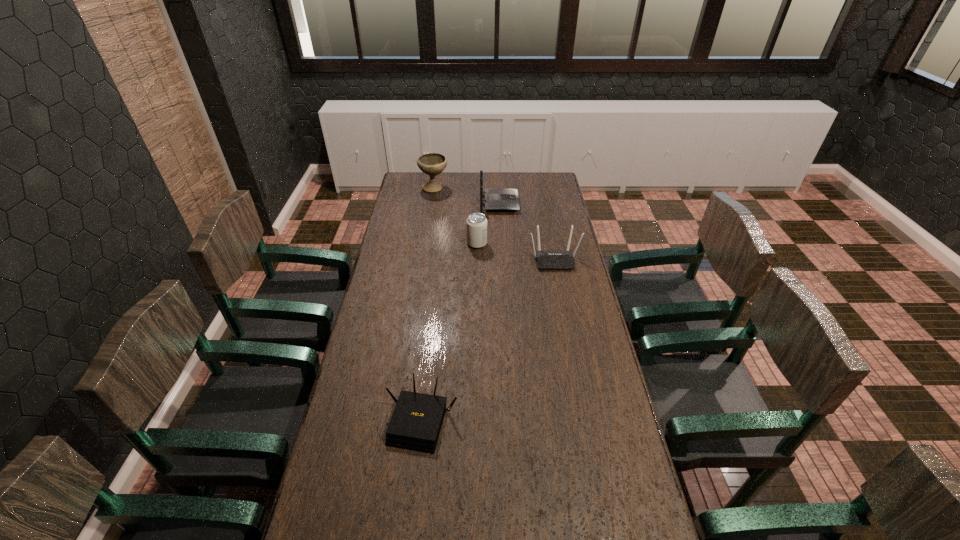
Where is `vacant space at the right edge of the desktop`? vacant space at the right edge of the desktop is located at coordinates (572, 247).

Identify the location of vacant space at the far right corner of the desktop. This screenshot has height=540, width=960. (557, 179).

I want to click on vacant space that's between the second nearest router and the second router from left to right, so click(527, 231).

At what (x,y) coordinates should I click in order to perform the action: click on vacant space that is in between the chalice and the second router from right to left. Please return your answer as a coordinate pair (x, y). Looking at the image, I should click on (467, 195).

At what (x,y) coordinates should I click in order to perform the action: click on free space between the tallest object and the farthest router. Please return your answer as a coordinate pair (x, y). This screenshot has height=540, width=960. Looking at the image, I should click on (467, 195).

Locate an element on the screen. The image size is (960, 540). vacant space in between the tallest object and the nearest router is located at coordinates (428, 304).

This screenshot has width=960, height=540. I want to click on blank region between the soda can and the second farthest router, so (516, 252).

In order to click on free space between the soda can and the leftmost router in this screenshot , I will do `click(449, 332)`.

The height and width of the screenshot is (540, 960). Identify the location of object that is the second closest to the rightmost object. (496, 199).

The width and height of the screenshot is (960, 540). I want to click on object that can be found as the closest to the soda can, so click(x=546, y=260).